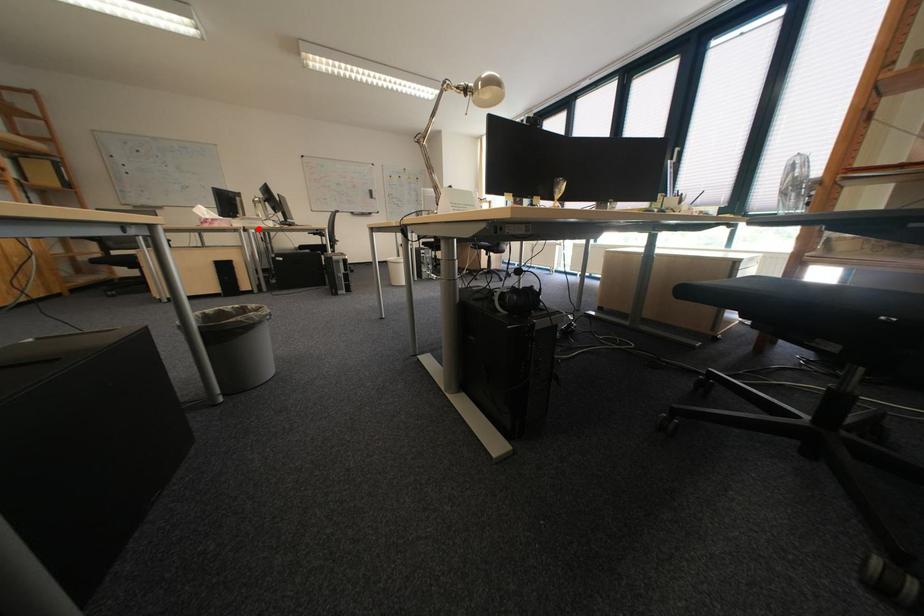
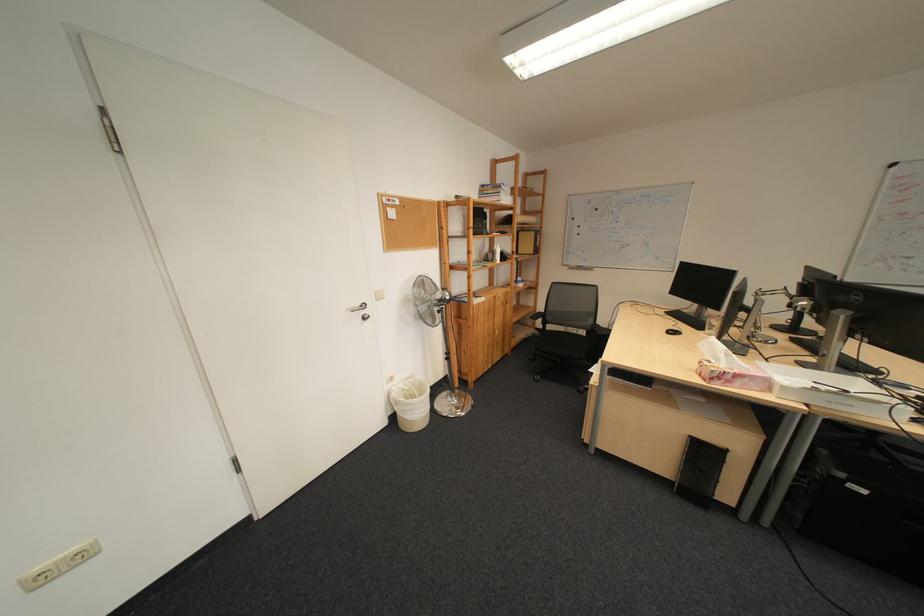
Question: I am providing you with two images of the same scene from different viewpoints. Image1 has a red point marked. In image2, the corresponding 3D location appears at what relative position? Reply with the corresponding letter.

Choices:
 (A) Closer
 (B) Farther

Answer: (B)